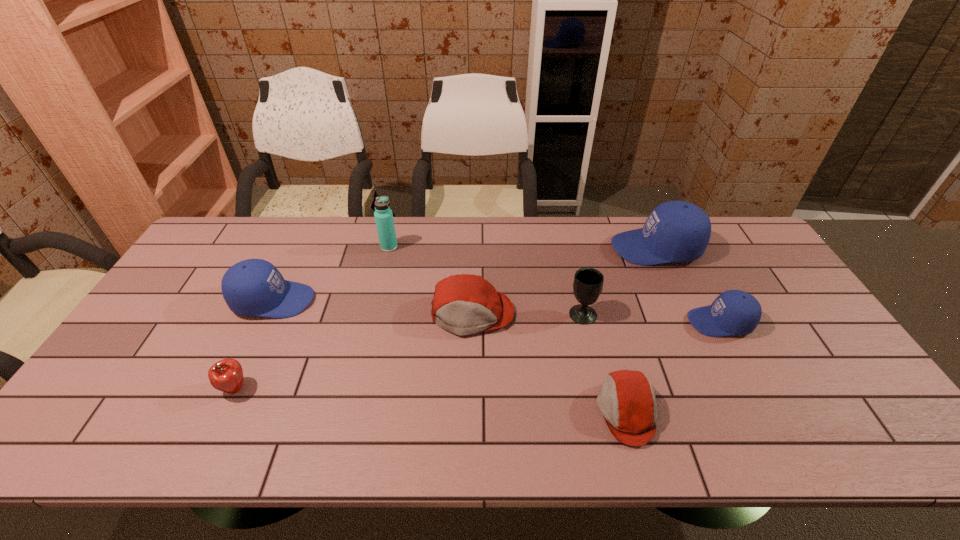
The height and width of the screenshot is (540, 960). Identify the location of the closest blue cap to the aqua thermos bottle. (254, 287).

Locate an element on the screen. The height and width of the screenshot is (540, 960). free spot that satisfies the following two spatial constraints: 1. on the front-facing side of the apple; 2. on the right side of the second biggest blue cap is located at coordinates (231, 389).